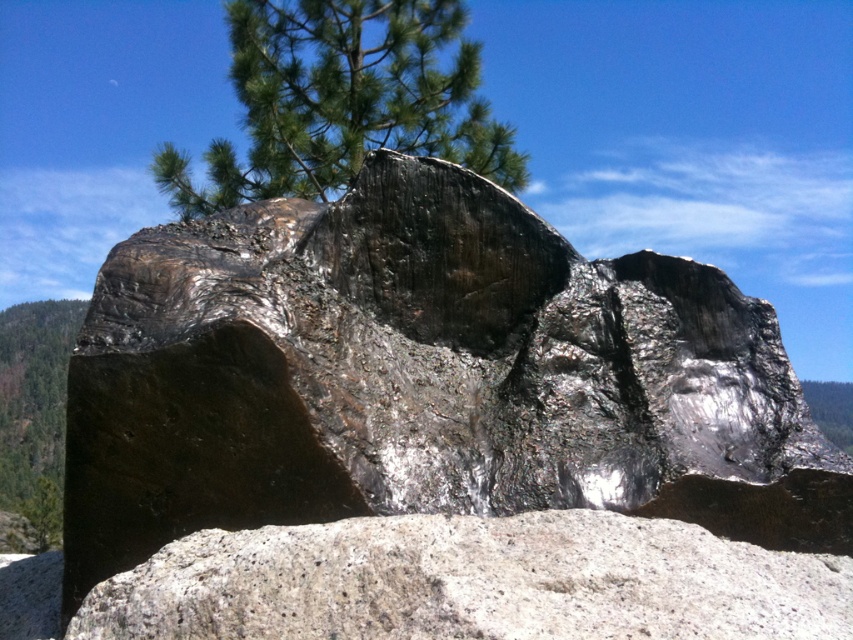
Between green textured pine tree at upper center and green matte tree at lower left, which one has less height?

With less height is green matte tree at lower left.

Is point (252, 129) farther from camera compared to point (19, 380)?

No, it is not.

Where is `green textured pine tree at upper center`? green textured pine tree at upper center is located at coordinates (341, 100).

How much distance is there between shiny metallic rock at center and green matte tree at lower left?

9.73 meters

Which is behind, point (483, 504) or point (78, 328)?

The point (78, 328) is more distant.

Between point (158, 381) and point (50, 518), which one is positioned behind?

Point (50, 518)

You are a GUI agent. You are given a task and a screenshot of the screen. Output one action in this format:
    pyautogui.click(x=<x>, y=<y>)
    Task: Click on the shiny metallic rock at center
    
    Given the screenshot: What is the action you would take?
    pyautogui.click(x=424, y=378)

Can you confirm if shiny metallic rock at center is bigger than green textured pine tree at upper center?

Incorrect, shiny metallic rock at center is not larger than green textured pine tree at upper center.

Who is positioned more to the right, shiny metallic rock at center or green textured pine tree at upper center?

From the viewer's perspective, shiny metallic rock at center appears more on the right side.

Who is more forward, (733, 509) or (451, 97)?

Positioned in front is point (733, 509).

The width and height of the screenshot is (853, 640). Identify the location of shiny metallic rock at center. point(424,378).